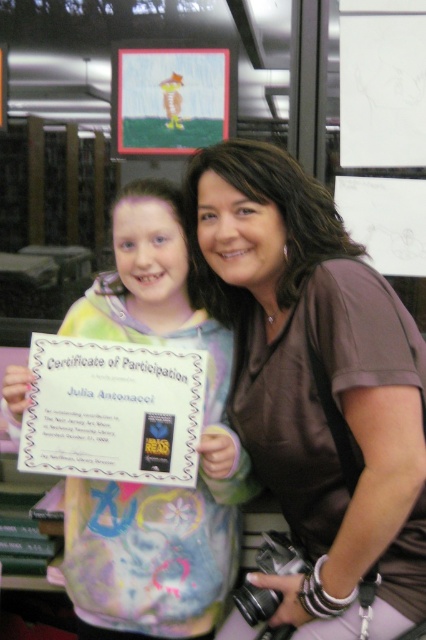
Who is more distant from viewer, (337, 589) or (224, 589)?

The point (224, 589) is more distant.

Between brown satin blouse at center and pastel tie-dye hoodie at center, which one appears on the right side from the viewer's perspective?

brown satin blouse at center

This screenshot has width=426, height=640. Find the location of `brown satin blouse at center`. brown satin blouse at center is located at coordinates (316, 385).

This screenshot has height=640, width=426. Identify the location of brown satin blouse at center. (316, 385).